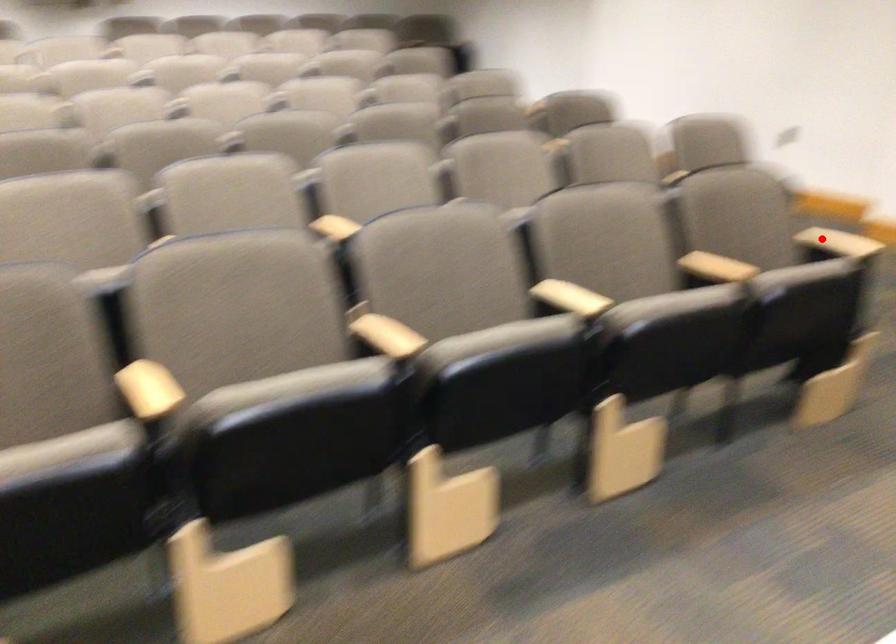
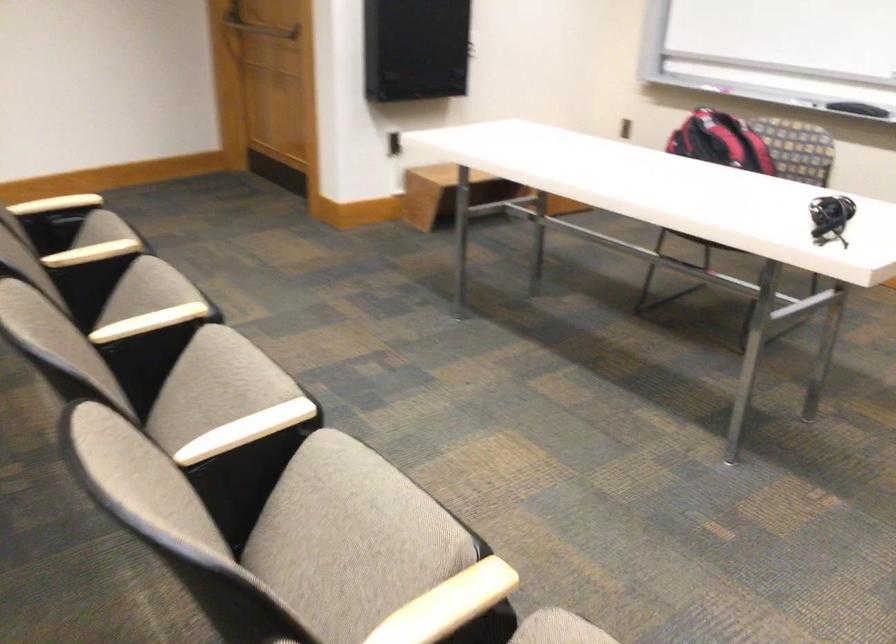
Find the pixel in the second image that matches the highlighted location in the first image.

(56, 204)